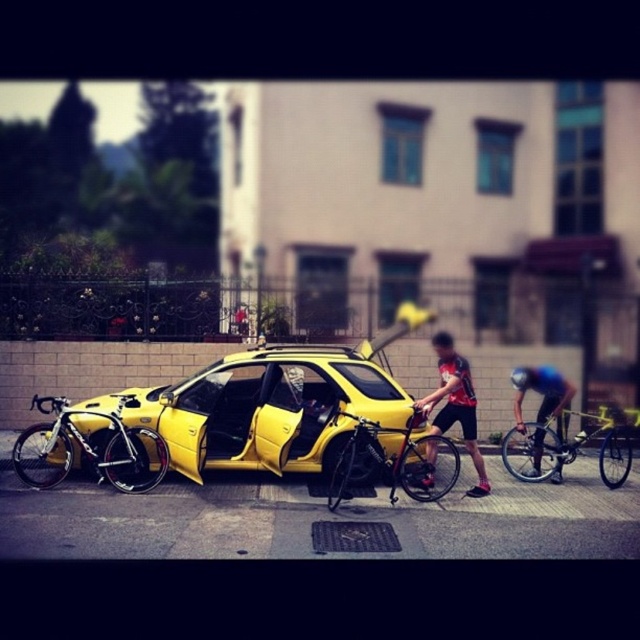
Does shiny black bicycle at center appear over blue fabric shirt at center?

Incorrect, shiny black bicycle at center is not positioned above blue fabric shirt at center.

In the scene shown: Between shiny black bicycle at center and blue fabric shirt at center, which one appears on the left side from the viewer's perspective?

shiny black bicycle at center is more to the left.

Is point (342, 477) closer to viewer compared to point (544, 394)?

Yes, point (342, 477) is closer to viewer.

Find the location of a particular element. Image resolution: width=640 pixels, height=640 pixels. shiny black bicycle at center is located at coordinates (388, 460).

What do you see at coordinates (90, 449) in the screenshot?
I see `shiny silver bicycle at left` at bounding box center [90, 449].

Between shiny silver bicycle at left and reddish-black jersey at center, which one has more height?

reddish-black jersey at center

Where is `shiny silver bicycle at left`? shiny silver bicycle at left is located at coordinates (90, 449).

Is shiny silver bicycle at left further to the viewer compared to black matte bicycle helmet at center?

No, it is not.

Does shiny silver bicycle at left have a greater width compared to black matte bicycle helmet at center?

Yes, shiny silver bicycle at left is wider than black matte bicycle helmet at center.

Locate an element on the screen. Image resolution: width=640 pixels, height=640 pixels. shiny silver bicycle at left is located at coordinates (90, 449).

The height and width of the screenshot is (640, 640). I want to click on shiny silver bicycle at left, so click(x=90, y=449).